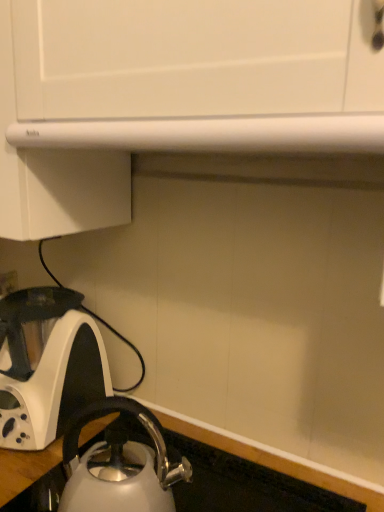
Where is `satin silver kettle at lower left, the second kettle when ordered from left to right`? satin silver kettle at lower left, the second kettle when ordered from left to right is located at coordinates pyautogui.click(x=119, y=465).

Image resolution: width=384 pixels, height=512 pixels. I want to click on white glossy countertop at lower left, so click(222, 486).

From the image's perspective, which object appears higher, satin silver kettle at lower left, the second kettle when ordered from left to right, or white glossy countertop at lower left?

satin silver kettle at lower left, the second kettle when ordered from left to right, appears higher in the image.

Considering the relative positions of satin silver kettle at lower left, marked as the second kettle in a back-to-front arrangement, and white glossy countertop at lower left in the image provided, is satin silver kettle at lower left, marked as the second kettle in a back-to-front arrangement, behind white glossy countertop at lower left?

Yes, it is behind white glossy countertop at lower left.

Considering the sizes of satin silver kettle at lower left, marked as the second kettle in a back-to-front arrangement, and white glossy countertop at lower left in the image, is satin silver kettle at lower left, marked as the second kettle in a back-to-front arrangement, bigger or smaller than white glossy countertop at lower left?

Considering their sizes, satin silver kettle at lower left, marked as the second kettle in a back-to-front arrangement, takes up less space than white glossy countertop at lower left.

Is white glossy kettle at lower left, placed as the second kettle when sorted from right to left, positioned behind white glossy countertop at lower left?

Yes.

From a real-world perspective, is white glossy kettle at lower left, which is the first kettle from back to front, above or below white glossy countertop at lower left?

In terms of real-world spatial position, white glossy kettle at lower left, which is the first kettle from back to front, is above white glossy countertop at lower left.

Considering the sizes of objects white glossy kettle at lower left, arranged as the first kettle when viewed from the left, and white glossy countertop at lower left in the image provided, who is shorter, white glossy kettle at lower left, arranged as the first kettle when viewed from the left, or white glossy countertop at lower left?

white glossy countertop at lower left.

Is white glossy countertop at lower left at the back of white glossy kettle at lower left, which appears as the 2th kettle when viewed from the front?

No, white glossy countertop at lower left is not at the back of white glossy kettle at lower left, which appears as the 2th kettle when viewed from the front.

Would you say white glossy countertop at lower left is to the left or to the right of satin silver kettle at lower left, the second kettle when ordered from left to right, in the picture?

Based on their positions, white glossy countertop at lower left is located to the right of satin silver kettle at lower left, the second kettle when ordered from left to right.

From the image's perspective, does white glossy countertop at lower left appear lower than satin silver kettle at lower left, the second kettle when ordered from left to right?

Yes.

Is white glossy countertop at lower left with satin silver kettle at lower left, the second kettle when ordered from left to right?

Yes, white glossy countertop at lower left and satin silver kettle at lower left, the second kettle when ordered from left to right, clearly make contact.

Considering the relative positions of white glossy kettle at lower left, arranged as the first kettle when viewed from the left, and satin silver kettle at lower left, marked as the second kettle in a back-to-front arrangement, in the image provided, is white glossy kettle at lower left, arranged as the first kettle when viewed from the left, to the left of satin silver kettle at lower left, marked as the second kettle in a back-to-front arrangement, from the viewer's perspective?

Yes, white glossy kettle at lower left, arranged as the first kettle when viewed from the left, is to the left of satin silver kettle at lower left, marked as the second kettle in a back-to-front arrangement.

Is white glossy kettle at lower left, placed as the second kettle when sorted from right to left, aimed at satin silver kettle at lower left, marked as the second kettle in a back-to-front arrangement?

No, white glossy kettle at lower left, placed as the second kettle when sorted from right to left, is not facing towards satin silver kettle at lower left, marked as the second kettle in a back-to-front arrangement.

Can you tell me how much white glossy kettle at lower left, arranged as the first kettle when viewed from the left, and satin silver kettle at lower left, positioned as the 1th kettle in front-to-back order, differ in facing direction?

white glossy kettle at lower left, arranged as the first kettle when viewed from the left, and satin silver kettle at lower left, positioned as the 1th kettle in front-to-back order, are facing 3.49 degrees away from each other.

Are white glossy kettle at lower left, which is the first kettle from back to front, and satin silver kettle at lower left, positioned as the 1th kettle in front-to-back order, far apart?

No, white glossy kettle at lower left, which is the first kettle from back to front, is in close proximity to satin silver kettle at lower left, positioned as the 1th kettle in front-to-back order.

From a real-world perspective, is white glossy countertop at lower left located higher than white glossy kettle at lower left, which appears as the 2th kettle when viewed from the front?

No, from a real-world perspective, white glossy countertop at lower left is not over white glossy kettle at lower left, which appears as the 2th kettle when viewed from the front

Is white glossy countertop at lower left in front of white glossy kettle at lower left, arranged as the first kettle when viewed from the left?

Yes.

Is white glossy kettle at lower left, placed as the second kettle when sorted from right to left, at the back of white glossy countertop at lower left?

No, white glossy countertop at lower left's orientation is not away from white glossy kettle at lower left, placed as the second kettle when sorted from right to left.

From the image's perspective, is white glossy countertop at lower left on white glossy kettle at lower left, which appears as the 2th kettle when viewed from the front?

No, from the image's perspective, white glossy countertop at lower left is not on top of white glossy kettle at lower left, which appears as the 2th kettle when viewed from the front.

From a real-world perspective, who is located higher, satin silver kettle at lower left, positioned as the 1th kettle in front-to-back order, or white glossy kettle at lower left, which is the first kettle from back to front?

white glossy kettle at lower left, which is the first kettle from back to front, from a real-world perspective.

Does satin silver kettle at lower left, which appears as the first kettle when viewed from the right, touch white glossy kettle at lower left, placed as the second kettle when sorted from right to left?

No, satin silver kettle at lower left, which appears as the first kettle when viewed from the right, is not with white glossy kettle at lower left, placed as the second kettle when sorted from right to left.

Where is `kettle that is the 1st object located behind the white glossy countertop at lower left`? The width and height of the screenshot is (384, 512). kettle that is the 1st object located behind the white glossy countertop at lower left is located at coordinates (119, 465).

In order to click on counter top in front of the white glossy kettle at lower left, which is the first kettle from back to front in this screenshot , I will do `click(222, 486)`.

When comparing their distances from satin silver kettle at lower left, marked as the second kettle in a back-to-front arrangement, does white glossy countertop at lower left or white glossy kettle at lower left, placed as the second kettle when sorted from right to left, seem closer?

white glossy countertop at lower left.

Based on their spatial positions, is white glossy countertop at lower left or satin silver kettle at lower left, positioned as the 1th kettle in front-to-back order, further from white glossy kettle at lower left, arranged as the first kettle when viewed from the left?

The object further to white glossy kettle at lower left, arranged as the first kettle when viewed from the left, is white glossy countertop at lower left.

Considering their positions, is white glossy kettle at lower left, which appears as the 2th kettle when viewed from the front, positioned closer to white glossy countertop at lower left than satin silver kettle at lower left, positioned as the 1th kettle in front-to-back order?

satin silver kettle at lower left, positioned as the 1th kettle in front-to-back order, lies closer to white glossy countertop at lower left than the other object.

Looking at this image, looking at the image, which one is located closer to satin silver kettle at lower left, marked as the second kettle in a back-to-front arrangement, white glossy kettle at lower left, placed as the second kettle when sorted from right to left, or white glossy countertop at lower left?

The object closer to satin silver kettle at lower left, marked as the second kettle in a back-to-front arrangement, is white glossy countertop at lower left.

Estimate the real-world distances between objects in this image. Which object is further from white glossy countertop at lower left, satin silver kettle at lower left, the second kettle when ordered from left to right, or white glossy kettle at lower left, which is the first kettle from back to front?

white glossy kettle at lower left, which is the first kettle from back to front, lies further to white glossy countertop at lower left than the other object.

Based on their spatial positions, is satin silver kettle at lower left, marked as the second kettle in a back-to-front arrangement, or white glossy countertop at lower left further from white glossy kettle at lower left, which is the first kettle from back to front?

white glossy countertop at lower left is positioned further to the anchor white glossy kettle at lower left, which is the first kettle from back to front.

Locate an element on the screen. Image resolution: width=384 pixels, height=512 pixels. kettle situated between white glossy kettle at lower left, arranged as the first kettle when viewed from the left, and white glossy countertop at lower left from left to right is located at coordinates (119, 465).